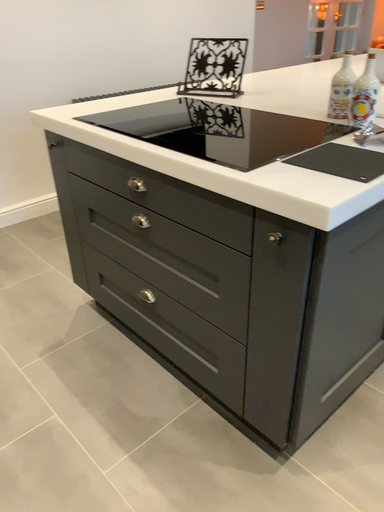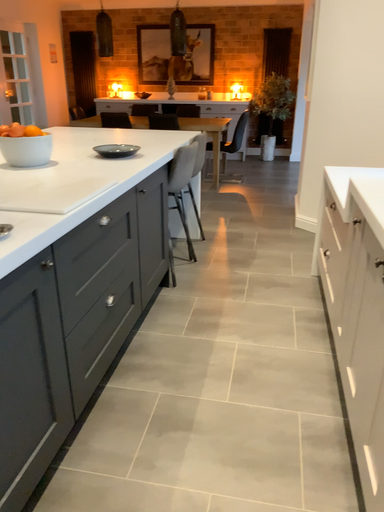
Question: Which way did the camera rotate in the video?

Choices:
 (A) rotated downward
 (B) rotated upward

Answer: (B)